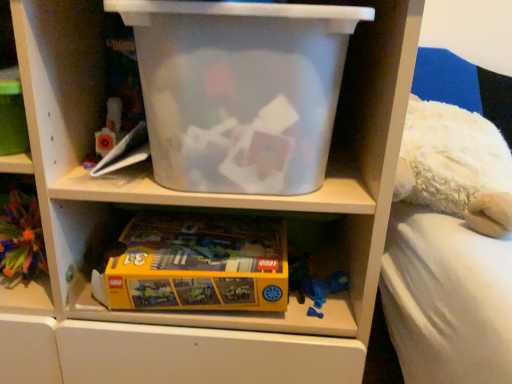
Question: From the image's perspective, is yellow cardboard lego box at lower center located above or below yellow matte lego box at lower left?

Choices:
 (A) above
 (B) below

Answer: (B)

Question: From their relative heights in the image, would you say yellow cardboard lego box at lower center is taller or shorter than yellow matte lego box at lower left?

Choices:
 (A) tall
 (B) short

Answer: (B)

Question: Estimate the real-world distances between objects in this image. Which object is farther from the yellow cardboard lego box at lower center?

Choices:
 (A) yellow matte lego box at lower left
 (B) transparent plastic storage box at upper center

Answer: (A)

Question: Based on their relative distances, which object is farther from the yellow cardboard lego box at lower center?

Choices:
 (A) yellow matte lego box at lower left
 (B) transparent plastic storage box at upper center

Answer: (A)